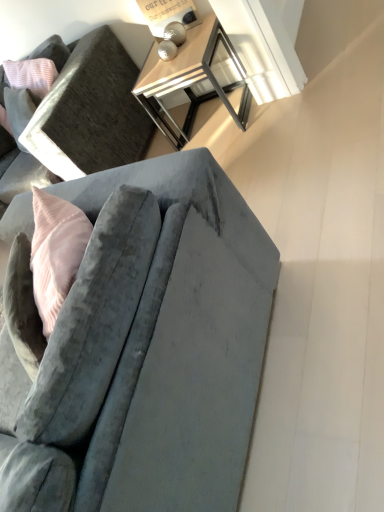
You are a GUI agent. You are given a task and a screenshot of the screen. Output one action in this format:
    pyautogui.click(x=<x>, y=<y>)
    Task: Click on the free spot below metallic silver table at upper center (from a real-world perspective)
    The image size is (384, 512).
    Given the screenshot: What is the action you would take?
    pyautogui.click(x=208, y=124)